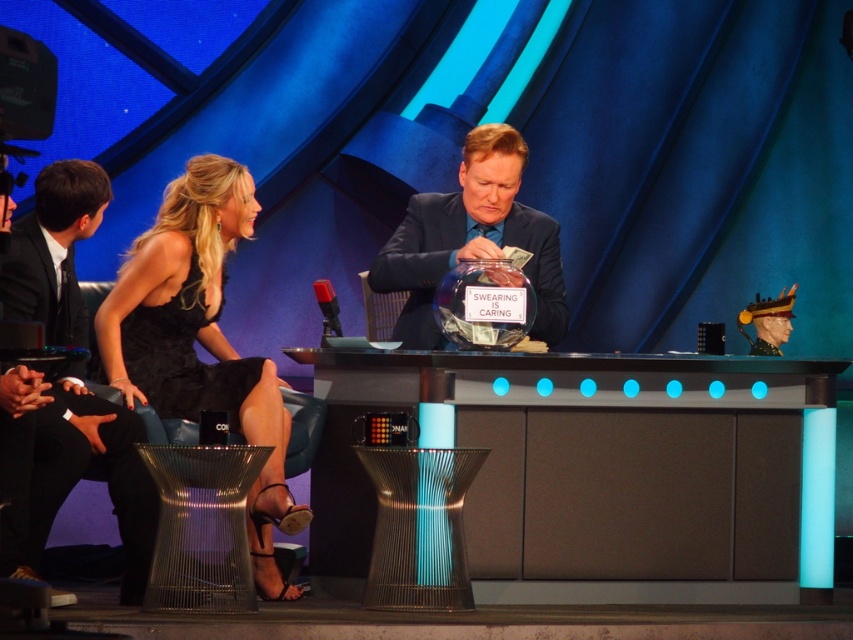
You are a costume designer preparing for a show and need to place the black satin dress at left and the shiny black suit at center on a rack. Based on the scene, which item is located to the left of the other?

The black satin dress at left is positioned on the left side of the shiny black suit at center, so the black satin dress at left is to the left of the shiny black suit at center.

You are a costume designer preparing for a show and need to choose between the black satin dress at left and the shiny black suit at center. Based on their sizes, which one would you recommend for a performer who needs more coverage?

The black satin dress at left is larger than the shiny black suit at center, so it would provide more coverage and is recommended for the performer.

You are a stagehand setting up for a show. You need to place a new prop on the desk between the black satin dress at center and the shiny black suit at center. Which object should you place it closer to if you want it to be above the dress?

You should place the new prop closer to the shiny black suit at center because the black satin dress at center is located below the shiny black suit at center. This means the shiny black suit is above the dress, so placing the prop near it would position it above the dress.